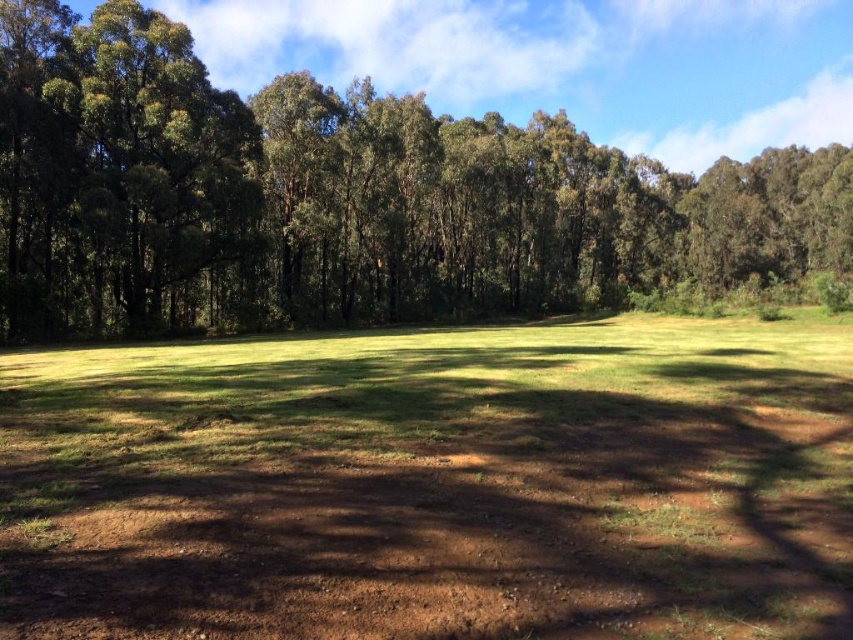
Between point (267, 618) and point (78, 172), which one is positioned in front?

Point (267, 618)

Does brown dirt field at center appear over green leafy tree at left?

No.

Measure the distance between brown dirt field at center and camera.

brown dirt field at center and camera are 12.61 feet apart from each other.

Locate an element on the screen. brown dirt field at center is located at coordinates (434, 484).

Can you confirm if green leafy tree at center is shorter than green leafy tree at left?

No, green leafy tree at center is not shorter than green leafy tree at left.

Between green leafy tree at center and green leafy tree at left, which one is positioned higher?

green leafy tree at center is above.

Who is more distant from viewer, (633,164) or (155,67)?

The point (633,164) is more distant.

This screenshot has height=640, width=853. Find the location of `green leafy tree at center`. green leafy tree at center is located at coordinates (343, 198).

Is point (213, 632) closer to viewer compared to point (120, 234)?

Yes, point (213, 632) is in front of point (120, 234).

Measure the distance from brown dirt field at center to green leafy tree at center.

brown dirt field at center is 50.86 meters from green leafy tree at center.

Who is more forward, (473, 570) or (743, 211)?

Point (473, 570) is more forward.

You are a GUI agent. You are given a task and a screenshot of the screen. Output one action in this format:
    pyautogui.click(x=<x>, y=<y>)
    Task: Click on the brown dirt field at center
    This screenshot has height=640, width=853.
    Given the screenshot: What is the action you would take?
    [434, 484]